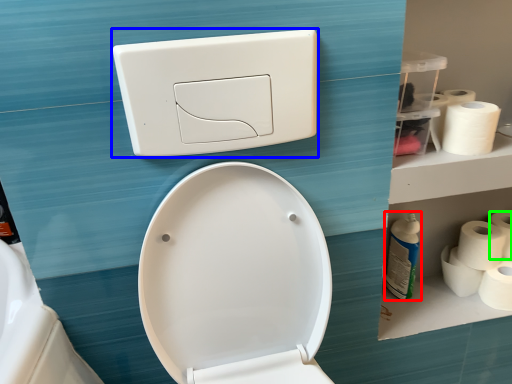
Question: Based on their relative distances, which object is nearer to cleaning product (highlighted by a red box)? Choose from light switch (highlighted by a blue box) and toilet paper (highlighted by a green box).

Choices:
 (A) light switch
 (B) toilet paper

Answer: (B)